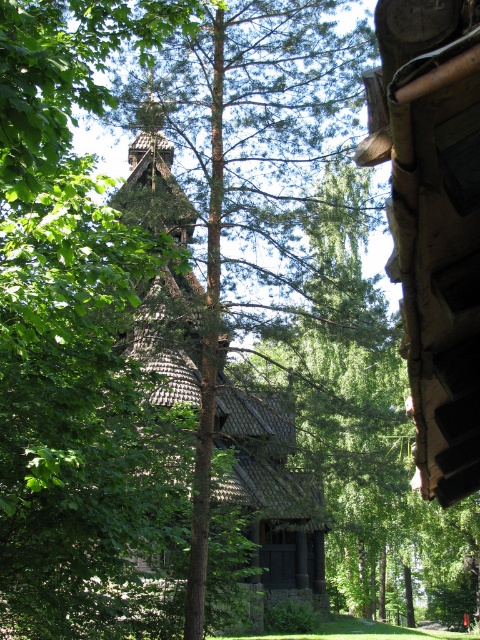
Does brown wooden hut at upper right have a lesser width compared to brown wooden hut at center?

Indeed, brown wooden hut at upper right has a lesser width compared to brown wooden hut at center.

The width and height of the screenshot is (480, 640). What are the coordinates of `brown wooden hut at upper right` in the screenshot? It's located at (434, 221).

Does point (452, 317) lie behind point (214, 205)?

That is False.

At what (x,y) coordinates should I click in order to perform the action: click on brown wooden hut at upper right. Please return your answer as a coordinate pair (x, y). The height and width of the screenshot is (640, 480). Looking at the image, I should click on (434, 221).

Is brown wooden hut at center smaller than wooden spire at center?

Actually, brown wooden hut at center might be larger than wooden spire at center.

Which is more to the right, brown wooden hut at center or wooden spire at center?

brown wooden hut at center is more to the right.

Does point (216, 417) lie in front of point (129, 147)?

Yes, it is.

Locate an element on the screen. This screenshot has width=480, height=640. brown wooden hut at center is located at coordinates (212, 442).

Can you confirm if brown wooden hut at upper right is bigger than wooden spire at center?

Actually, brown wooden hut at upper right might be smaller than wooden spire at center.

Is point (458, 403) less distant than point (162, 118)?

That is True.

Which is behind, point (468, 147) or point (130, 152)?

The point (130, 152) is more distant.

Locate an element on the screen. Image resolution: width=480 pixels, height=640 pixels. brown wooden hut at upper right is located at coordinates pyautogui.click(x=434, y=221).